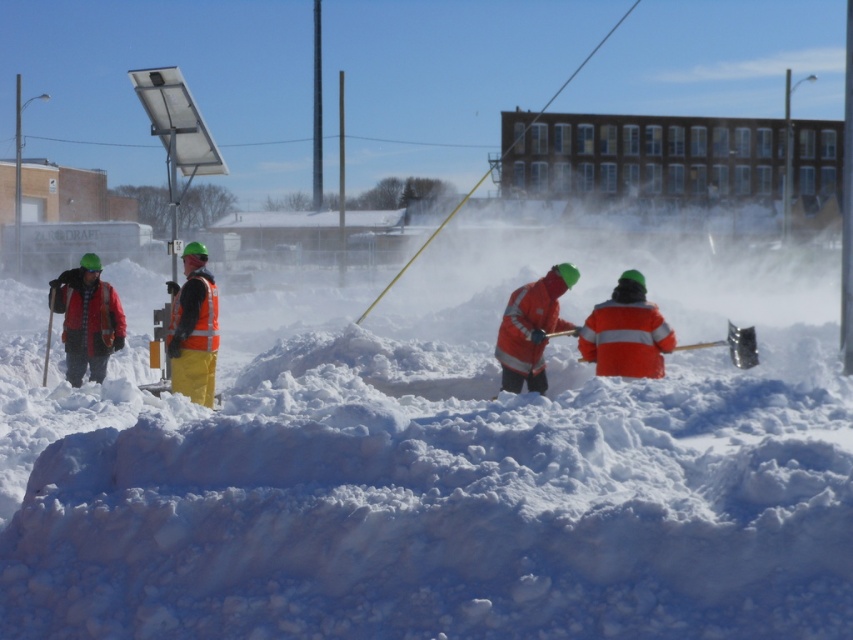
Question: Is the position of white fluffy snow at center less distant than that of orange reflective vest at center?

Choices:
 (A) yes
 (B) no

Answer: (A)

Question: Which point is closer to the camera?

Choices:
 (A) (724, 342)
 (B) (412, 403)
 (C) (80, 273)
 (D) (503, 340)

Answer: (B)

Question: Is orange reflective vest at center positioned before orange reflective jacket at center?

Choices:
 (A) yes
 (B) no

Answer: (A)

Question: Which point is farther to the camera?

Choices:
 (A) orange reflective shovel at center
 (B) orange reflective vest at center
 (C) plaid wool jacket at left
 (D) white fluffy snow at center

Answer: (C)

Question: Which point is farther to the camera?

Choices:
 (A) plaid wool jacket at left
 (B) orange reflective shovel at center
 (C) orange reflective jacket at center
 (D) white fluffy snow at center

Answer: (A)

Question: Is plaid wool jacket at left bigger than orange reflective shovel at center?

Choices:
 (A) no
 (B) yes

Answer: (B)